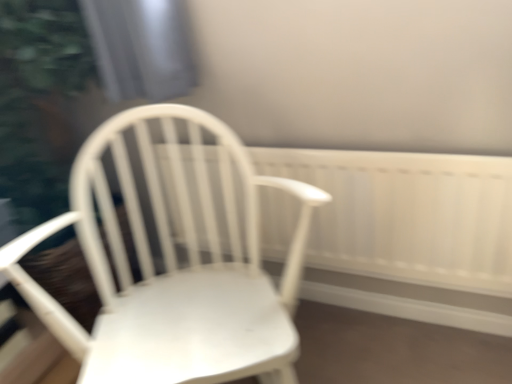
Question: From the image's perspective, does white matte wood chair at center appear higher than white wooden radiator at center?

Choices:
 (A) yes
 (B) no

Answer: (B)

Question: Is white matte wood chair at center further to camera compared to white wooden radiator at center?

Choices:
 (A) yes
 (B) no

Answer: (B)

Question: Does white matte wood chair at center appear on the left side of white wooden radiator at center?

Choices:
 (A) no
 (B) yes

Answer: (B)

Question: Is white matte wood chair at center next to white wooden radiator at center and touching it?

Choices:
 (A) no
 (B) yes

Answer: (A)

Question: Can you confirm if white matte wood chair at center is thinner than white wooden radiator at center?

Choices:
 (A) yes
 (B) no

Answer: (B)

Question: Does white matte wood chair at center have a greater height compared to white wooden radiator at center?

Choices:
 (A) yes
 (B) no

Answer: (A)

Question: From a real-world perspective, is white wooden radiator at center below white matte wood chair at center?

Choices:
 (A) yes
 (B) no

Answer: (A)

Question: Considering the relative sizes of white wooden radiator at center and white matte wood chair at center in the image provided, is white wooden radiator at center bigger than white matte wood chair at center?

Choices:
 (A) no
 (B) yes

Answer: (A)

Question: Is white wooden radiator at center closer to camera compared to white matte wood chair at center?

Choices:
 (A) no
 (B) yes

Answer: (A)

Question: Is white wooden radiator at center thinner than white matte wood chair at center?

Choices:
 (A) yes
 (B) no

Answer: (A)

Question: Is white matte wood chair at center a part of white wooden radiator at center?

Choices:
 (A) yes
 (B) no

Answer: (B)

Question: Does white wooden radiator at center have a greater height compared to white matte wood chair at center?

Choices:
 (A) yes
 (B) no

Answer: (B)

Question: Is point (195, 256) positioned closer to the camera than point (411, 251)?

Choices:
 (A) closer
 (B) farther

Answer: (B)